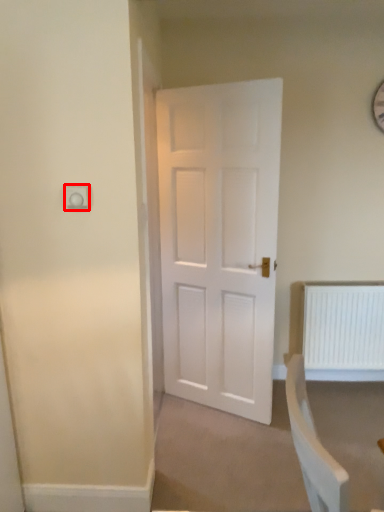
Question: From the image's perspective, where is electric outlet (annotated by the red box) located relative to radiator?

Choices:
 (A) above
 (B) below

Answer: (A)